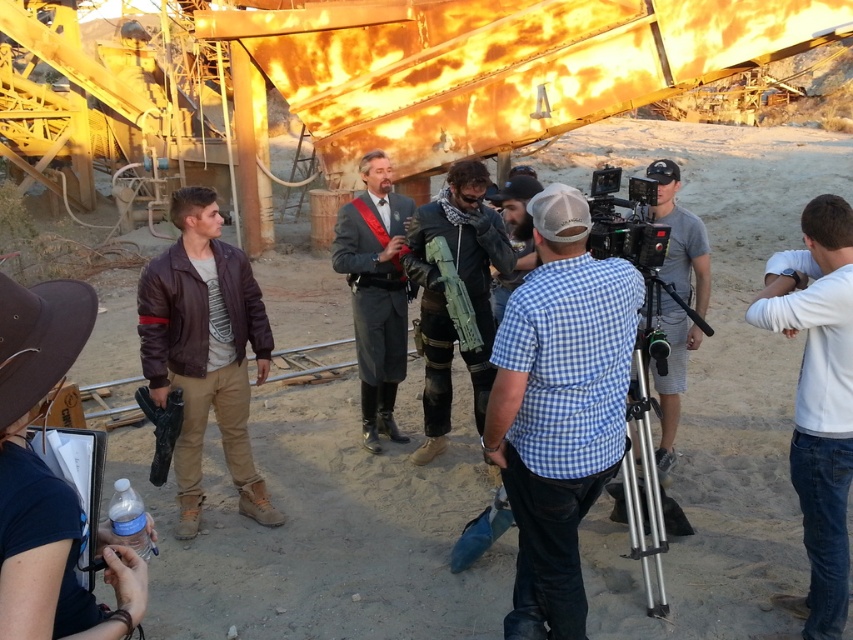
Question: Which point is farther to the camera?

Choices:
 (A) brown leather jacket at left
 (B) gray fabric shirt at center
 (C) silver metallic tripod at center
 (D) black plastic video camera at center

Answer: (A)

Question: Is brown leather jacket at left further to the viewer compared to brown leather cowboy hat at lower left?

Choices:
 (A) no
 (B) yes

Answer: (B)

Question: Can you confirm if brown leather cowboy hat at lower left is thinner than silver metallic tripod at center?

Choices:
 (A) yes
 (B) no

Answer: (A)

Question: Among these objects, which one is farthest from the camera?

Choices:
 (A) brown leather cowboy hat at lower left
 (B) brown leather jacket at lower left

Answer: (A)

Question: Can you confirm if brown leather jacket at left is smaller than gray wool suit at center?

Choices:
 (A) no
 (B) yes

Answer: (A)

Question: Based on their relative distances, which object is farther from the brown leather cowboy hat at lower left?

Choices:
 (A) black plastic video camera at center
 (B) brown leather jacket at lower left
 (C) blue checkered shirt at center

Answer: (A)